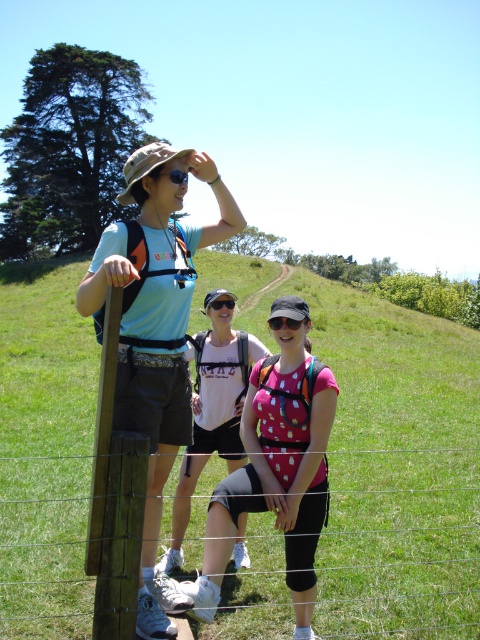
Looking at this image, you are trying to decide which of the two people in the center has a wider shirt. You see the matte blue shirt at center and the pink dotted shirt at center. Which one is wider?

The matte blue shirt at center is wider than the pink dotted shirt at center according to the description.

Consider the image. You are a photographer trying to capture a group photo of the matte blue shirt at center and the pink dotted shirt at center. Since you want to ensure both are fully visible in the photo, which one should you position closer to the camera?

The matte blue shirt at center is in front of the pink dotted shirt at center, so positioning the matte blue shirt at center closer to the camera will ensure both are visible without one blocking the other.